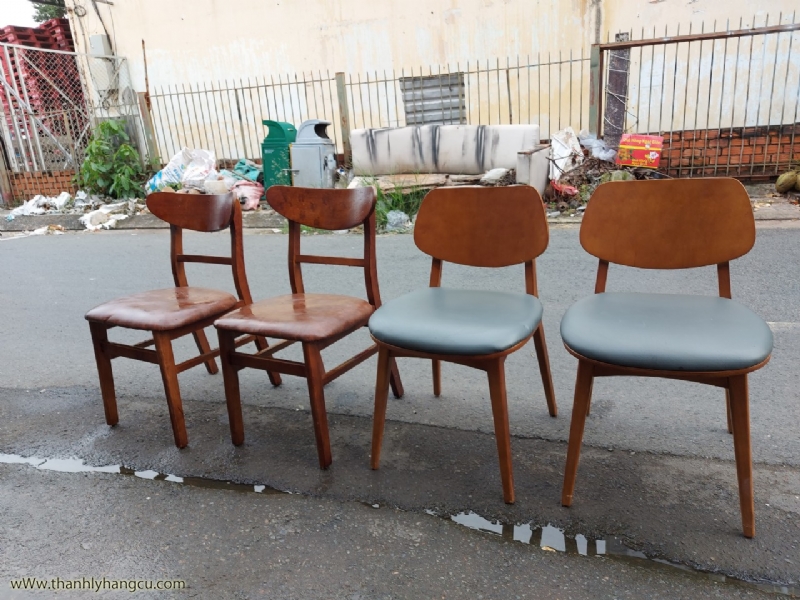
In order to click on chairs in this screenshot , I will do `click(146, 301)`, `click(258, 318)`, `click(405, 313)`, `click(608, 327)`.